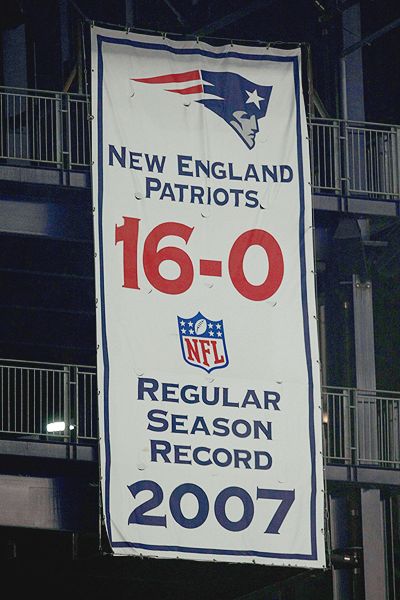
This screenshot has width=400, height=600. What are the coordinates of `metallic frame` in the screenshot? It's located at (310, 73).